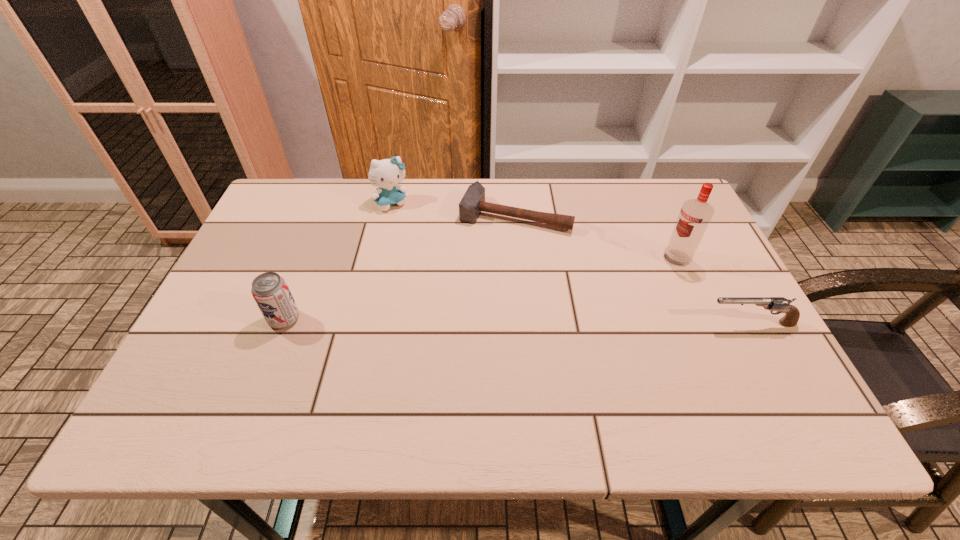
Where is `vacant space located aiming along the barrel of the second shortest object`? The width and height of the screenshot is (960, 540). vacant space located aiming along the barrel of the second shortest object is located at coordinates (629, 323).

Identify the location of vacant space located aiming along the barrel of the second shortest object. The image size is (960, 540). (547, 323).

The image size is (960, 540). In order to click on vacant space located aiming along the barrel of the second shortest object in this screenshot , I will do `click(573, 323)`.

You are a GUI agent. You are given a task and a screenshot of the screen. Output one action in this format:
    pyautogui.click(x=<x>, y=<y>)
    Task: Click on the free space located on the striking surface of the third object from right to left
    
    Given the screenshot: What is the action you would take?
    (470, 303)

Locate an element on the screen. free space located 0.320m on the striking surface of the third object from right to left is located at coordinates 465,319.

The height and width of the screenshot is (540, 960). Find the location of `vacant region located 0.200m on the striking surface of the third object from right to left`. vacant region located 0.200m on the striking surface of the third object from right to left is located at coordinates (x=479, y=284).

Image resolution: width=960 pixels, height=540 pixels. Identify the location of vacant area situated 0.110m on the face of the second tallest object. (411, 233).

Locate an element on the screen. The width and height of the screenshot is (960, 540). vacant space situated on the face of the second tallest object is located at coordinates (435, 271).

At what (x,y) coordinates should I click in order to perform the action: click on blank space located 0.250m on the face of the second tallest object. Please return your answer as a coordinate pair (x, y). The image size is (960, 540). Looking at the image, I should click on (431, 264).

You are a GUI agent. You are given a task and a screenshot of the screen. Output one action in this format:
    pyautogui.click(x=<x>, y=<y>)
    Task: Click on the vacant space situated on the front label of the vodka
    Image resolution: width=960 pixels, height=540 pixels.
    Given the screenshot: What is the action you would take?
    pyautogui.click(x=570, y=323)